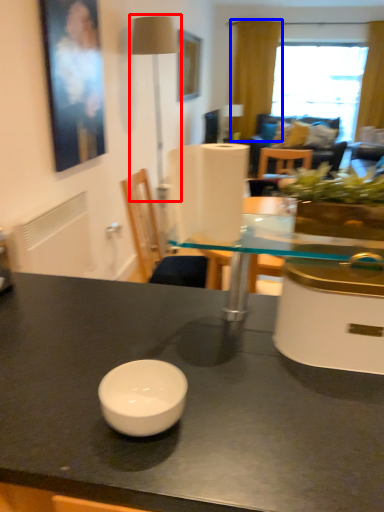
Question: Which of the following is the farthest to the observer, table lamp (highlighted by a red box) or curtain (highlighted by a blue box)?

Choices:
 (A) table lamp
 (B) curtain

Answer: (B)